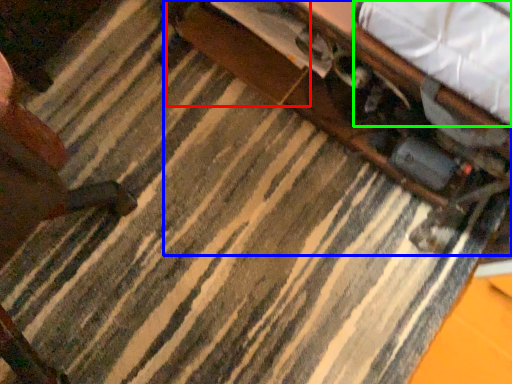
Question: Considering the real-world distances, which object is farthest from drawer (highlighted by a red box)? table (highlighted by a blue box) or sheet (highlighted by a green box)?

Choices:
 (A) table
 (B) sheet

Answer: (B)